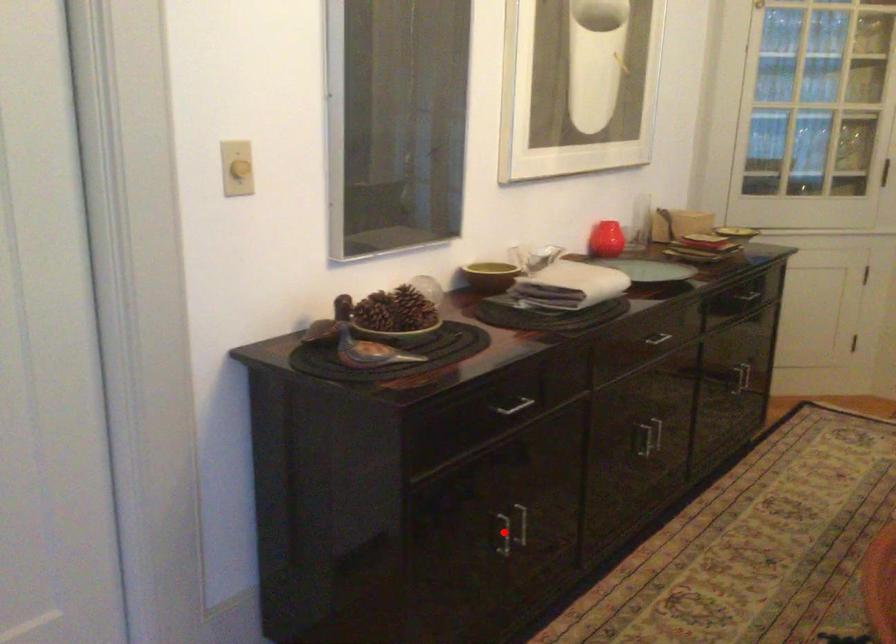
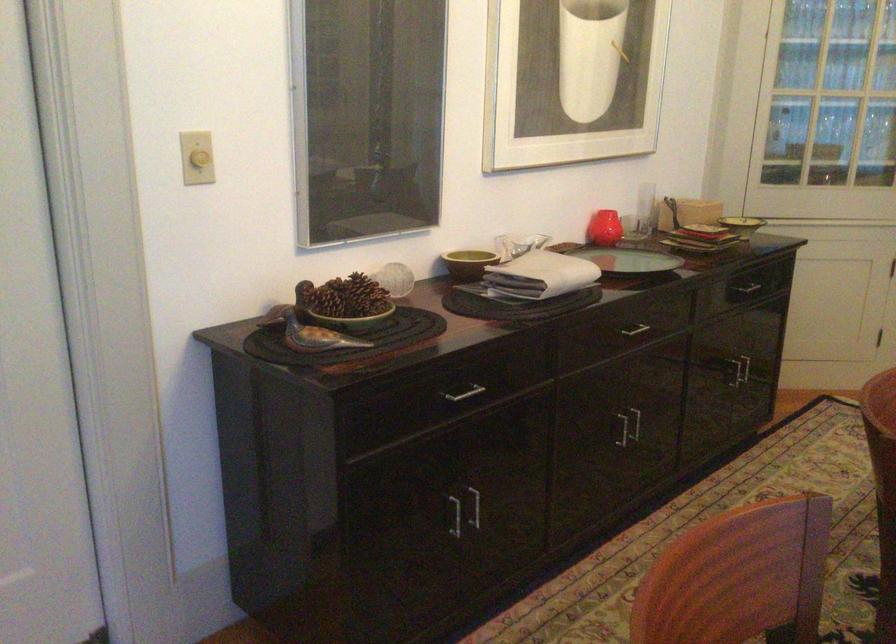
The point at the highlighted location is marked in the first image. Where is the corresponding point in the second image?

(453, 514)